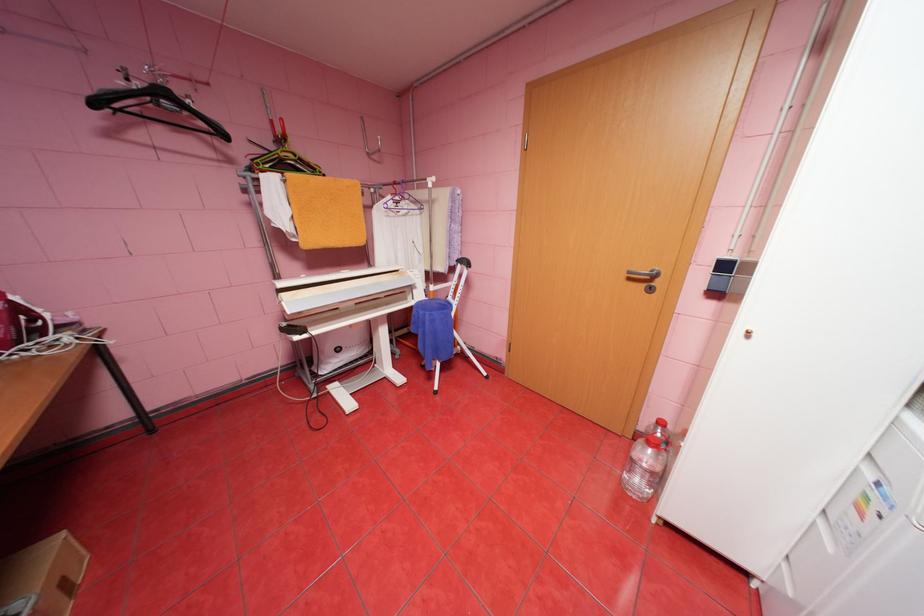
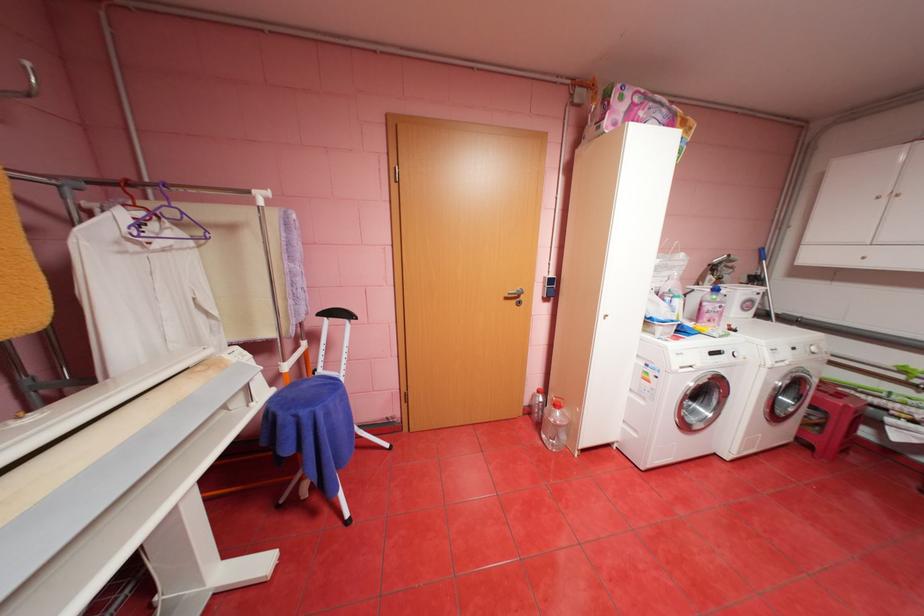
Question: The first image is from the beginning of the video and the second image is from the end. How did the camera likely rotate when shooting the video?

Choices:
 (A) Left
 (B) Right
 (C) Up
 (D) Down

Answer: (B)